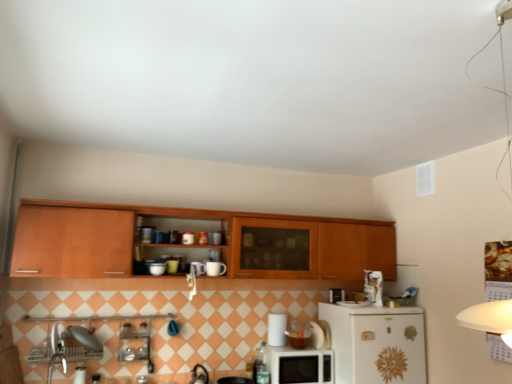
Question: Can you confirm if wooden cabinet at upper center is positioned to the left of white glossy refrigerator at lower right?

Choices:
 (A) no
 (B) yes

Answer: (B)

Question: From a real-world perspective, is wooden cabinet at upper center positioned under white glossy refrigerator at lower right based on gravity?

Choices:
 (A) yes
 (B) no

Answer: (B)

Question: Is wooden cabinet at upper center positioned in front of white glossy refrigerator at lower right?

Choices:
 (A) yes
 (B) no

Answer: (A)

Question: Can you confirm if wooden cabinet at upper center is wider than white glossy refrigerator at lower right?

Choices:
 (A) yes
 (B) no

Answer: (B)

Question: Is wooden cabinet at upper center next to white glossy refrigerator at lower right and touching it?

Choices:
 (A) no
 (B) yes

Answer: (A)

Question: From the image's perspective, would you say wooden cabinet at upper center is positioned over white glossy refrigerator at lower right?

Choices:
 (A) no
 (B) yes

Answer: (B)

Question: Is white glossy microwave at lower center to the left of wooden cabinet at upper center from the viewer's perspective?

Choices:
 (A) yes
 (B) no

Answer: (B)

Question: Can you confirm if white glossy microwave at lower center is bigger than wooden cabinet at upper center?

Choices:
 (A) no
 (B) yes

Answer: (A)

Question: From the image's perspective, is white glossy microwave at lower center over wooden cabinet at upper center?

Choices:
 (A) yes
 (B) no

Answer: (B)

Question: Is white glossy microwave at lower center to the right of wooden cabinet at upper center from the viewer's perspective?

Choices:
 (A) no
 (B) yes

Answer: (B)

Question: Does white glossy microwave at lower center contain wooden cabinet at upper center?

Choices:
 (A) yes
 (B) no

Answer: (B)

Question: Would you consider white glossy microwave at lower center to be distant from wooden cabinet at upper center?

Choices:
 (A) yes
 (B) no

Answer: (B)

Question: Is white glossy refrigerator at lower right facing towards white glossy microwave at lower center?

Choices:
 (A) yes
 (B) no

Answer: (B)